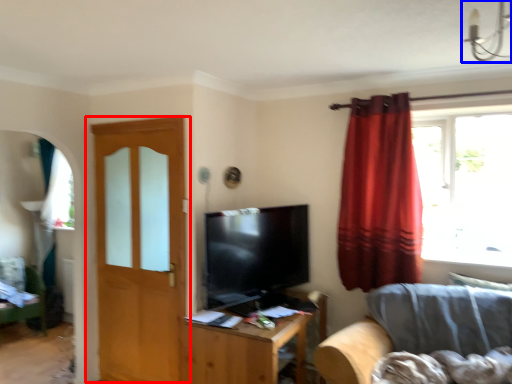
Question: Which object is closer to the camera taking this photo, door (highlighted by a red box) or light fixture (highlighted by a blue box)?

Choices:
 (A) door
 (B) light fixture

Answer: (B)